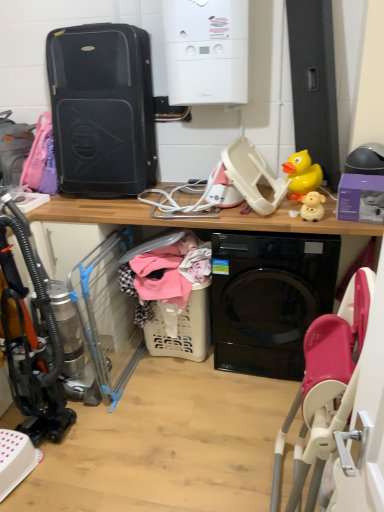
Locate an element on the screen. Image resolution: width=384 pixels, height=512 pixels. free space in front of black hard shell suitcase at upper left is located at coordinates [108, 206].